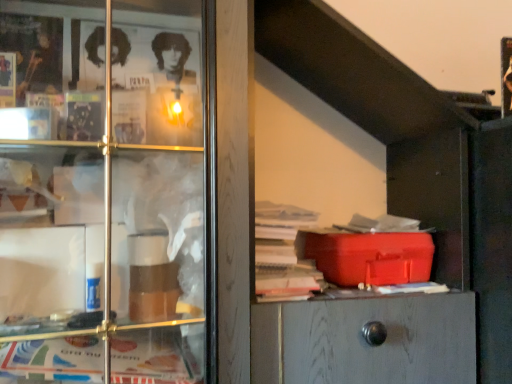
Identify the location of blank space situated above matte plastic storage box at center (from a real-world perspective). click(x=373, y=226).